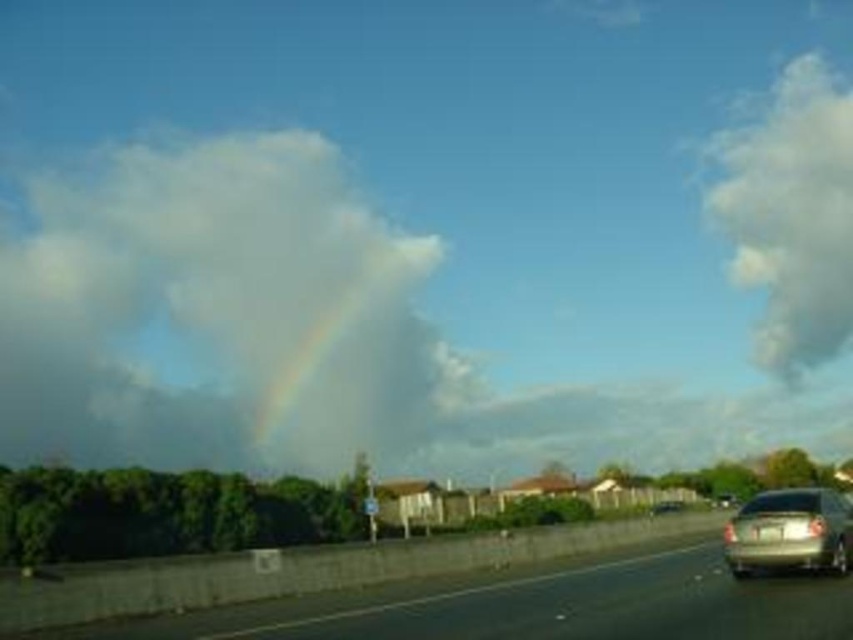
You are standing on the road and looking up at the sky. Which object is closer to you, the white fluffy cloud at upper left or the metallic asphalt highway at lower center?

The white fluffy cloud at upper left is closer to you than the metallic asphalt highway at lower center because it is positioned further to the viewer.

Based on the photo, you are a drone operator trying to capture a photo of the metallic asphalt highway at lower center. The drone has a maximum flight range of 600 meters. Can the drone safely reach the white fluffy cloud at upper left to take a photo of the highway without exceeding its range?

The distance between the white fluffy cloud at upper left and the metallic asphalt highway at lower center is 657.30 meters. Since the drone can only fly up to 600 meters, it cannot safely reach the cloud to take the photo without exceeding its range.

Consider the image. You are a drone operator trying to capture a photo of the white fluffy cloud at upper left and the metallic asphalt highway at lower center. Which object is higher in the image?

The white fluffy cloud at upper left is taller than the metallic asphalt highway at lower center, so it is higher in the image.